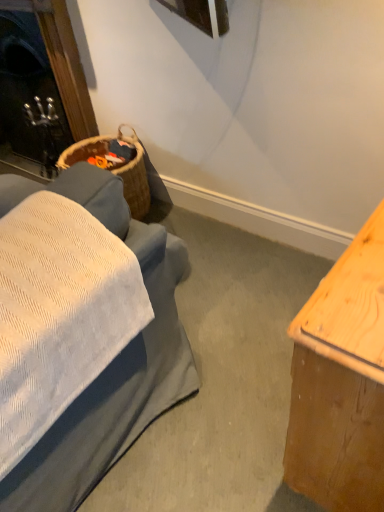
Locate an element on the screen. black glass fireplace at upper left is located at coordinates (63, 61).

The image size is (384, 512). Describe the element at coordinates (63, 61) in the screenshot. I see `black glass fireplace at upper left` at that location.

This screenshot has height=512, width=384. Describe the element at coordinates (341, 382) in the screenshot. I see `light brown wood table at right` at that location.

At what (x,y) coordinates should I click in order to perform the action: click on light brown wood table at right. Please return your answer as a coordinate pair (x, y). Looking at the image, I should click on (341, 382).

Find the location of a particular element. The width and height of the screenshot is (384, 512). black glass fireplace at upper left is located at coordinates (x=63, y=61).

Is black glass fireplace at upper left to the left or to the right of light brown wood table at right in the image?

In the image, black glass fireplace at upper left appears on the left side of light brown wood table at right.

Is the depth of black glass fireplace at upper left greater than that of light brown wood table at right?

That is True.

Which is behind, point (72, 134) or point (358, 243)?

Positioned behind is point (72, 134).

Consider the image. From the image's perspective, which one is positioned lower, black glass fireplace at upper left or light brown wood table at right?

light brown wood table at right.

From a real-world perspective, which is physically below, black glass fireplace at upper left or light brown wood table at right?

In real-world perspective, light brown wood table at right is lower.

Which of these two, black glass fireplace at upper left or light brown wood table at right, is thinner?

black glass fireplace at upper left is thinner.

Considering the sizes of objects black glass fireplace at upper left and light brown wood table at right in the image provided, who is taller, black glass fireplace at upper left or light brown wood table at right?

With more height is black glass fireplace at upper left.

Is black glass fireplace at upper left bigger or smaller than light brown wood table at right?

Clearly, black glass fireplace at upper left is larger in size than light brown wood table at right.

Is light brown wood table at right inside black glass fireplace at upper left?

No, light brown wood table at right is not surrounded by black glass fireplace at upper left.

Is black glass fireplace at upper left far from light brown wood table at right?

Yes, black glass fireplace at upper left and light brown wood table at right are located far from each other.

Does black glass fireplace at upper left turn towards light brown wood table at right?

No, black glass fireplace at upper left is not oriented towards light brown wood table at right.

Where is `table located in front of the black glass fireplace at upper left`? This screenshot has height=512, width=384. table located in front of the black glass fireplace at upper left is located at coordinates (341, 382).

Looking at this image, which object is positioned more to the right, light brown wood table at right or black glass fireplace at upper left?

light brown wood table at right is more to the right.

In the scene shown: Considering their positions, is light brown wood table at right located in front of or behind black glass fireplace at upper left?

In the image, light brown wood table at right appears in front of black glass fireplace at upper left.

Does point (313, 420) come closer to viewer compared to point (53, 21)?

Yes, point (313, 420) is in front of point (53, 21).

From the image's perspective, who appears lower, light brown wood table at right or black glass fireplace at upper left?

light brown wood table at right, from the image's perspective.

From a real-world perspective, is light brown wood table at right positioned above or below black glass fireplace at upper left?

Clearly, from a real-world perspective, light brown wood table at right is below black glass fireplace at upper left.

Looking at this image, does light brown wood table at right have a lesser width compared to black glass fireplace at upper left?

In fact, light brown wood table at right might be wider than black glass fireplace at upper left.

Considering the relative sizes of light brown wood table at right and black glass fireplace at upper left in the image provided, is light brown wood table at right shorter than black glass fireplace at upper left?

Indeed, light brown wood table at right has a lesser height compared to black glass fireplace at upper left.

Which of these two, light brown wood table at right or black glass fireplace at upper left, is smaller?

With smaller size is light brown wood table at right.

Is light brown wood table at right not within black glass fireplace at upper left?

Absolutely, light brown wood table at right is external to black glass fireplace at upper left.

Would you consider light brown wood table at right to be distant from black glass fireplace at upper left?

Yes.

Is black glass fireplace at upper left at the back of light brown wood table at right?

light brown wood table at right does not have its back to black glass fireplace at upper left.

How different are the orientations of light brown wood table at right and black glass fireplace at upper left in degrees?

light brown wood table at right and black glass fireplace at upper left are facing 90 degrees away from each other.

Locate an element on the screen. fireplace lying on the left of light brown wood table at right is located at coordinates (63, 61).

Locate an element on the screen. fireplace above the light brown wood table at right (from a real-world perspective) is located at coordinates (63, 61).

The height and width of the screenshot is (512, 384). In order to click on table in front of the black glass fireplace at upper left in this screenshot , I will do `click(341, 382)`.